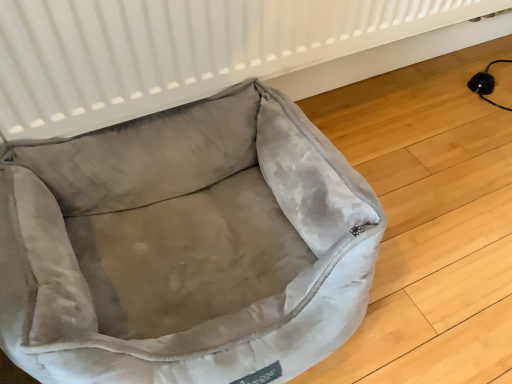
What do you see at coordinates (185, 247) in the screenshot?
I see `velvet-like beige dog bed at lower left` at bounding box center [185, 247].

Where is `velvet-like beige dog bed at lower left`? velvet-like beige dog bed at lower left is located at coordinates (185, 247).

Measure the distance between velvet-like beige dog bed at lower left and camera.

velvet-like beige dog bed at lower left is 18.12 inches away from camera.

What is the approximate height of velvet-like beige dog bed at lower left?

The height of velvet-like beige dog bed at lower left is 9.41 inches.

Where is `white textured radiator at upper center`? white textured radiator at upper center is located at coordinates (180, 50).

The width and height of the screenshot is (512, 384). Describe the element at coordinates (180, 50) in the screenshot. I see `white textured radiator at upper center` at that location.

The image size is (512, 384). Identify the location of velvet-like beige dog bed at lower left. (185, 247).

Which object is positioned more to the right, white textured radiator at upper center or velvet-like beige dog bed at lower left?

white textured radiator at upper center is more to the right.

Is white textured radiator at upper center in front of or behind velvet-like beige dog bed at lower left in the image?

In the image, white textured radiator at upper center appears behind velvet-like beige dog bed at lower left.

Is point (358, 72) more distant than point (279, 158)?

Yes, it is.

From the image's perspective, which is below, white textured radiator at upper center or velvet-like beige dog bed at lower left?

From the image's view, velvet-like beige dog bed at lower left is below.

From a real-world perspective, which is physically below, white textured radiator at upper center or velvet-like beige dog bed at lower left?

In real-world perspective, velvet-like beige dog bed at lower left is lower.

Considering the sizes of objects white textured radiator at upper center and velvet-like beige dog bed at lower left in the image provided, who is wider, white textured radiator at upper center or velvet-like beige dog bed at lower left?

velvet-like beige dog bed at lower left.

From the picture: Which of these two, white textured radiator at upper center or velvet-like beige dog bed at lower left, stands shorter?

velvet-like beige dog bed at lower left.

Considering the relative sizes of white textured radiator at upper center and velvet-like beige dog bed at lower left in the image provided, is white textured radiator at upper center smaller than velvet-like beige dog bed at lower left?

Indeed, white textured radiator at upper center has a smaller size compared to velvet-like beige dog bed at lower left.

Is velvet-like beige dog bed at lower left completely or partially inside white textured radiator at upper center?

No, white textured radiator at upper center does not contain velvet-like beige dog bed at lower left.

Is white textured radiator at upper center touching velvet-like beige dog bed at lower left?

There is a gap between white textured radiator at upper center and velvet-like beige dog bed at lower left.

Is white textured radiator at upper center turned away from velvet-like beige dog bed at lower left?

No, white textured radiator at upper center is not facing away from velvet-like beige dog bed at lower left.

How different are the orientations of white textured radiator at upper center and velvet-like beige dog bed at lower left in degrees?

white textured radiator at upper center and velvet-like beige dog bed at lower left are facing 1.59 degrees away from each other.

Find the location of `dog bed below the white textured radiator at upper center (from a real-world perspective)`. dog bed below the white textured radiator at upper center (from a real-world perspective) is located at coordinates tap(185, 247).

Is velvet-like beige dog bed at lower left at the right side of white textured radiator at upper center?

In fact, velvet-like beige dog bed at lower left is to the left of white textured radiator at upper center.

From the picture: Between velvet-like beige dog bed at lower left and white textured radiator at upper center, which one is positioned behind?

Positioned behind is white textured radiator at upper center.

Between point (182, 297) and point (170, 27), which one is positioned in front?

Point (170, 27)

Based on the photo, from the image's perspective, relative to white textured radiator at upper center, is velvet-like beige dog bed at lower left above or below?

From the image's perspective, velvet-like beige dog bed at lower left appears below white textured radiator at upper center.

From a real-world perspective, does velvet-like beige dog bed at lower left sit lower than white textured radiator at upper center?

Yes, from a real-world perspective, velvet-like beige dog bed at lower left is below white textured radiator at upper center.

Considering the sizes of objects velvet-like beige dog bed at lower left and white textured radiator at upper center in the image provided, who is wider, velvet-like beige dog bed at lower left or white textured radiator at upper center?

velvet-like beige dog bed at lower left.

Considering the relative sizes of velvet-like beige dog bed at lower left and white textured radiator at upper center in the image provided, is velvet-like beige dog bed at lower left taller than white textured radiator at upper center?

No, velvet-like beige dog bed at lower left is not taller than white textured radiator at upper center.

From the picture: Does velvet-like beige dog bed at lower left have a larger size compared to white textured radiator at upper center?

Yes.

Would you say velvet-like beige dog bed at lower left is outside white textured radiator at upper center?

Yes, velvet-like beige dog bed at lower left is located beyond the bounds of white textured radiator at upper center.

Is velvet-like beige dog bed at lower left placed right next to white textured radiator at upper center?

velvet-like beige dog bed at lower left and white textured radiator at upper center are clearly separated.

Could you tell me if velvet-like beige dog bed at lower left is turned towards white textured radiator at upper center?

No, velvet-like beige dog bed at lower left is not facing towards white textured radiator at upper center.

Where is `radiator lying on the right of velvet-like beige dog bed at lower left`? This screenshot has width=512, height=384. radiator lying on the right of velvet-like beige dog bed at lower left is located at coordinates (180, 50).

Locate an element on the screen. The image size is (512, 384). dog bed on the left of white textured radiator at upper center is located at coordinates (185, 247).

Where is `radiator behind the velvet-like beige dog bed at lower left`? radiator behind the velvet-like beige dog bed at lower left is located at coordinates (180, 50).